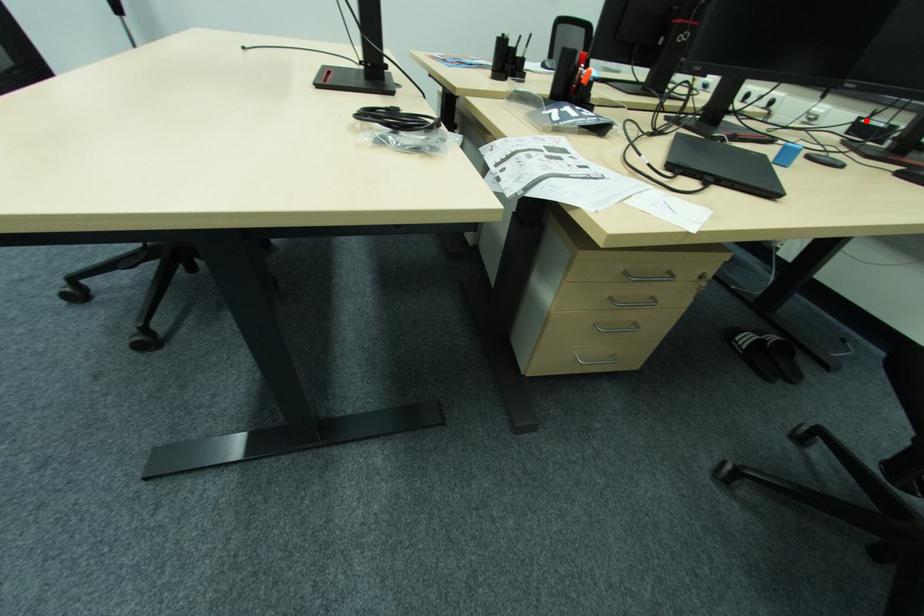
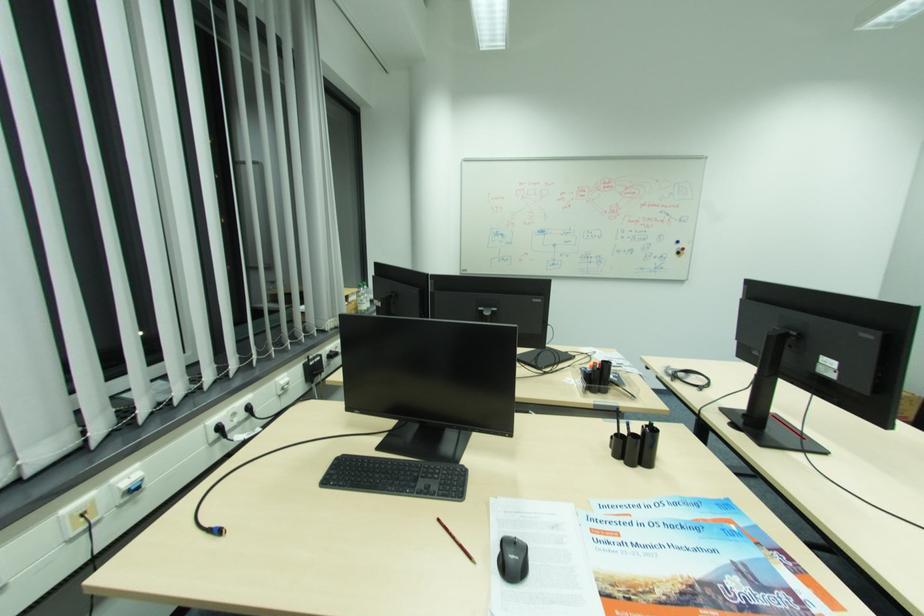
The point at the highlighted location is marked in the first image. Where is the corresponding point in the second image?

(311, 365)